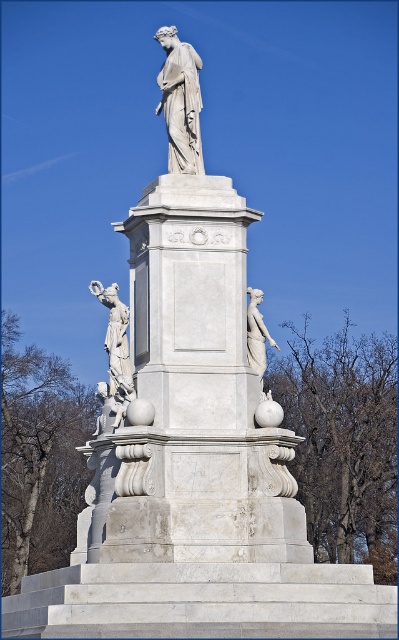
Where is `white marble statue at center`? This screenshot has height=640, width=399. white marble statue at center is located at coordinates (181, 100).

Is white marble statue at center below white marble statue at left?

No.

Measure the distance between point (169, 97) and camera.

Point (169, 97) and camera are 238.09 feet apart.

Find the location of `white marble statue at center`. white marble statue at center is located at coordinates (181, 100).